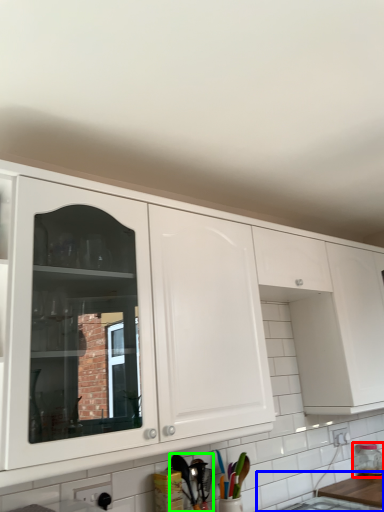
Question: Which object is positioned farthest from bottle (highlighted by a red box)? Select from counter top (highlighted by a blue box) and cutlery (highlighted by a green box).

Choices:
 (A) counter top
 (B) cutlery

Answer: (B)